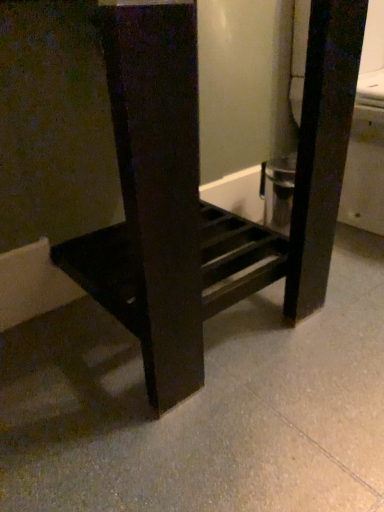
At what (x,y) coordinates should I click in order to perform the action: click on matte black shelf at lower center. Please return your answer as a coordinate pair (x, y). Looking at the image, I should click on point(197,192).

What is the approximate height of matte black shelf at lower center?

matte black shelf at lower center is 26.86 inches in height.

What is the approximate width of matte black shelf at lower center?

matte black shelf at lower center is 18.44 inches in width.

What do you see at coordinates (197, 192) in the screenshot? I see `matte black shelf at lower center` at bounding box center [197, 192].

You are a GUI agent. You are given a task and a screenshot of the screen. Output one action in this format:
    pyautogui.click(x=<x>, y=<y>)
    Task: Click on the matte black shelf at lower center
    This screenshot has width=384, height=512.
    Given the screenshot: What is the action you would take?
    pyautogui.click(x=197, y=192)